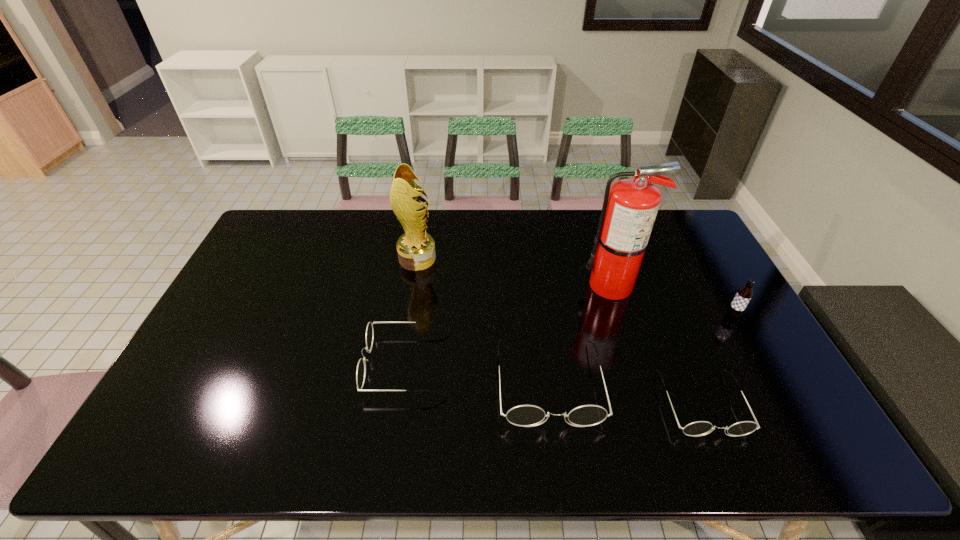
The spectacless are evenly distributed in the image. To maintain this, where would you place another spectacles on the left? Please point to a free space. Please provide its 2D coordinates. Your answer should be formatted as a tuple, i.e. [(x, y)], where the tuple contains the x and y coordinates of a point satisfying the conditions above.

[(276, 346)]